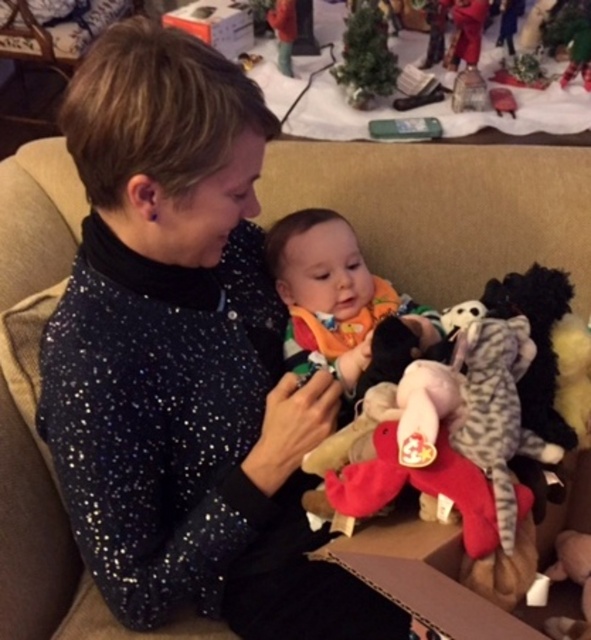
You are a guest at a holiday party and see the cardboard box at lower right and the velvet plush toy at upper center in the room. Which object is positioned more to the right side of the room?

The cardboard box at lower right is positioned to the right of the velvet plush toy at upper center, so the cardboard box at lower right is more to the right side of the room.

You are a guest at a holiday party and notice two plush toys in the background of the scene. The green plush toy at upper right and the velvet plush reindeer at upper right. Which one appears taller?

The green plush toy at upper right appears taller than the velvet plush reindeer at upper right.

You are a delivery person who just arrived at a house. You need to place a package that is 5 feet long in the space between the cardboard box at lower right and the velvet plush reindeer at upper right. Is there enough space for the package?

The cardboard box at lower right is 4.55 feet away from the velvet plush reindeer at upper right. Since the package is 5 feet long, it is slightly longer than the available space between them. Therefore, the package will not fit in that space.